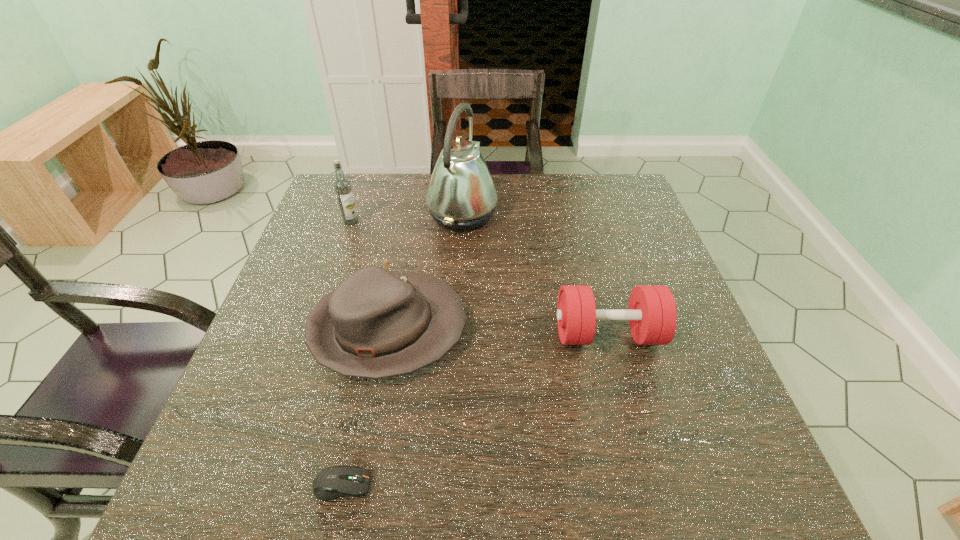
Identify the location of vacant space at the left edge of the desktop. (287, 284).

In the image, there is a desktop. Where is `free space at the right edge`? This screenshot has width=960, height=540. free space at the right edge is located at coordinates (670, 284).

The image size is (960, 540). In the image, there is a desktop. What are the coordinates of `free region at the far left corner` in the screenshot? It's located at (347, 173).

Identify the location of blank space at the near right corner of the desktop. Image resolution: width=960 pixels, height=540 pixels. pos(732,456).

The image size is (960, 540). I want to click on empty space between the vodka and the tallest object, so click(x=407, y=217).

Where is `vacant region between the computer equipment and the hat`? This screenshot has width=960, height=540. vacant region between the computer equipment and the hat is located at coordinates (365, 407).

Where is `vacant area that lies between the kettle and the hat`? This screenshot has height=540, width=960. vacant area that lies between the kettle and the hat is located at coordinates (425, 271).

I want to click on vacant area that lies between the kettle and the rightmost object, so click(535, 273).

I want to click on vacant area that lies between the shortest object and the hat, so click(365, 407).

Find the location of a particular element. The width and height of the screenshot is (960, 540). free point between the vodka and the tallest object is located at coordinates (407, 217).